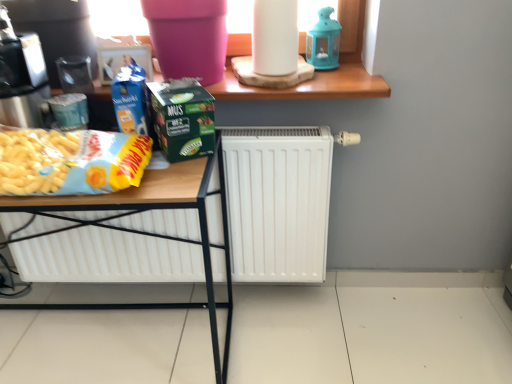
You are a GUI agent. You are given a task and a screenshot of the screen. Output one action in this format:
    pyautogui.click(x=<x>, y=<y>)
    Task: Click on the free location in front of blue glass lantern at upper center
    Image resolution: width=512 pixels, height=384 pixels.
    Given the screenshot: What is the action you would take?
    pyautogui.click(x=343, y=82)